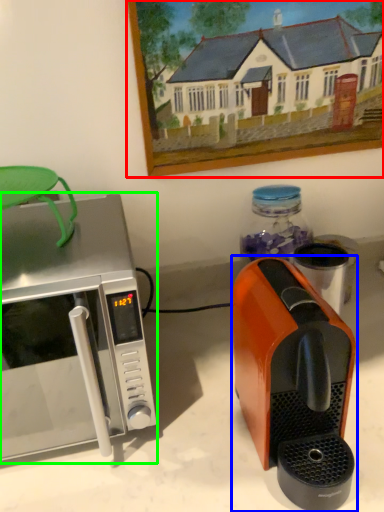
Question: Which is nearer to the picture frame (highlighted by a red box)? coffee maker (highlighted by a blue box) or microwave oven (highlighted by a green box).

Choices:
 (A) coffee maker
 (B) microwave oven

Answer: (B)